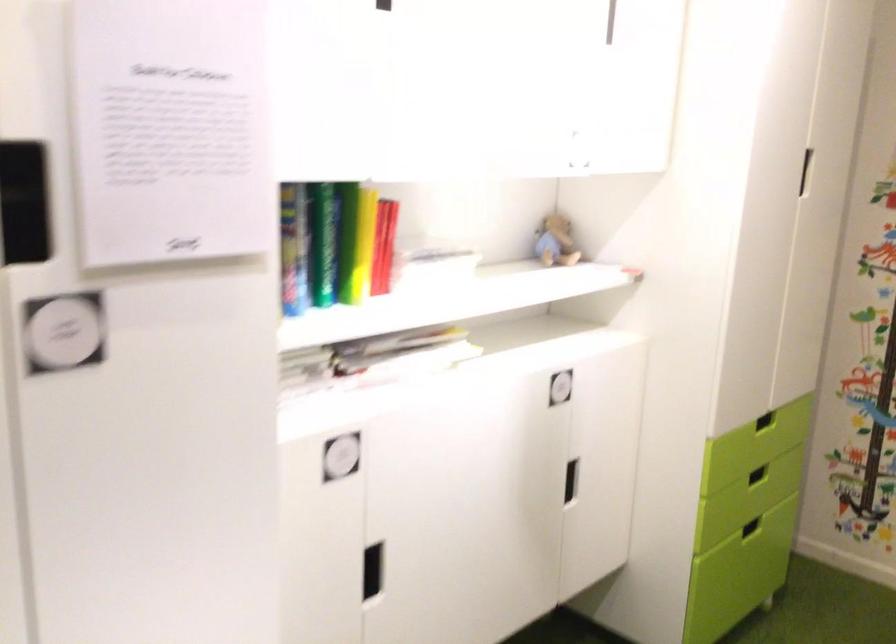
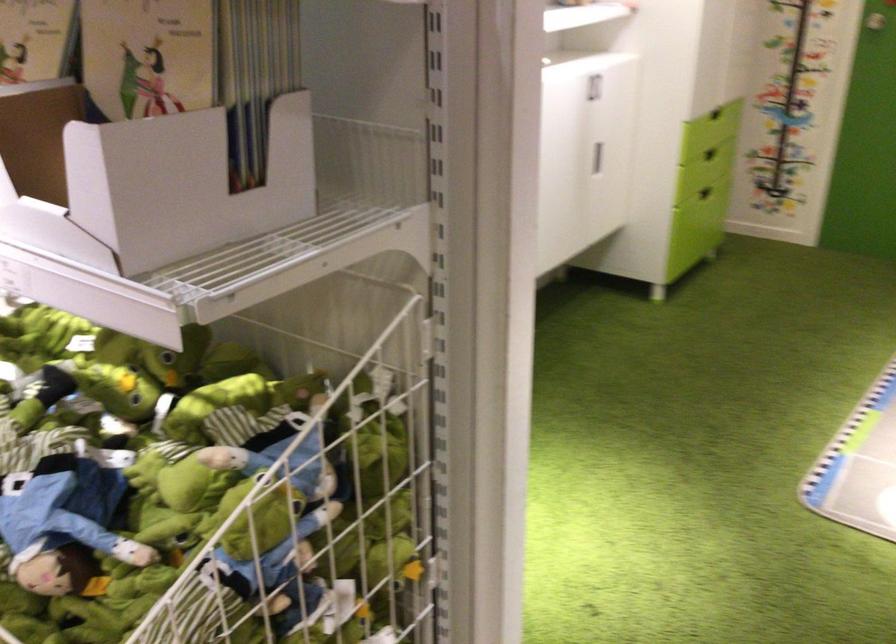
In the second image, find the point that corresponds to pixel 748 476 in the first image.

(710, 154)